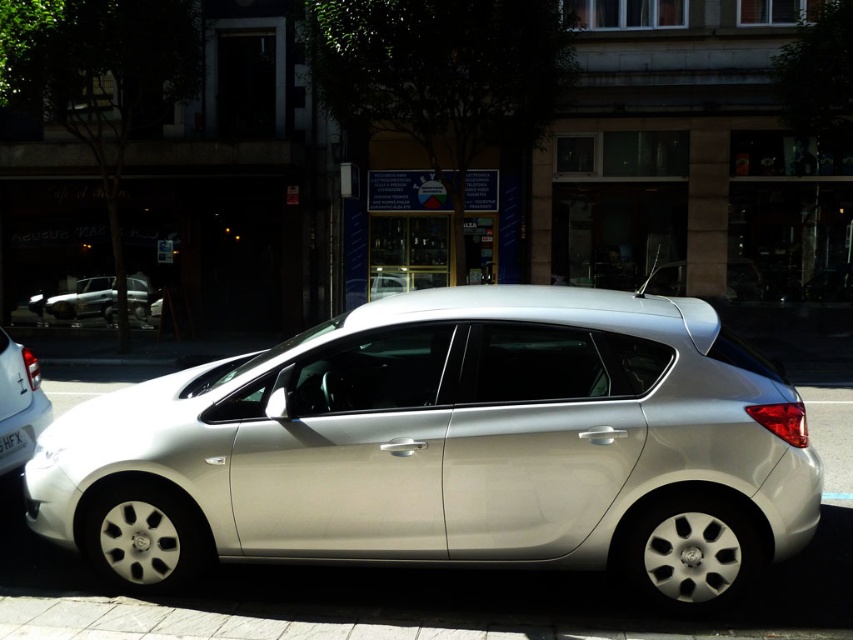
Is point (28, 355) farther from viewer compared to point (22, 445)?

Yes, it is behind point (22, 445).

I want to click on silver metallic hatchback at lower left, so click(19, 403).

What do you see at coordinates (19, 403) in the screenshot?
I see `silver metallic hatchback at lower left` at bounding box center [19, 403].

The image size is (853, 640). I want to click on silver metallic hatchback at lower left, so click(x=19, y=403).

Can you confirm if satin silver car at center is positioned below silver metallic hatchback at center?

Yes.

Consider the image. Can you confirm if satin silver car at center is positioned to the left of silver metallic hatchback at center?

No, satin silver car at center is not to the left of silver metallic hatchback at center.

Describe the element at coordinates (450, 449) in the screenshot. The image size is (853, 640). I see `satin silver car at center` at that location.

This screenshot has width=853, height=640. I want to click on satin silver car at center, so click(450, 449).

Can you confirm if satin silver car at center is smaller than white plastic license plate at center?

Incorrect, satin silver car at center is not smaller in size than white plastic license plate at center.

Between point (718, 392) and point (0, 440), which one is positioned in front?

Positioned in front is point (718, 392).

Locate an element on the screen. Image resolution: width=853 pixels, height=640 pixels. satin silver car at center is located at coordinates (450, 449).